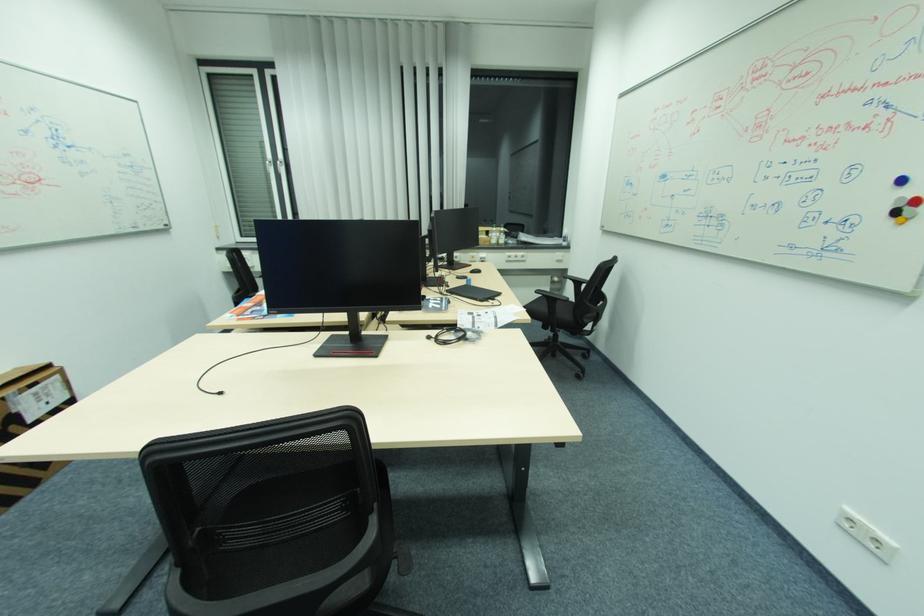
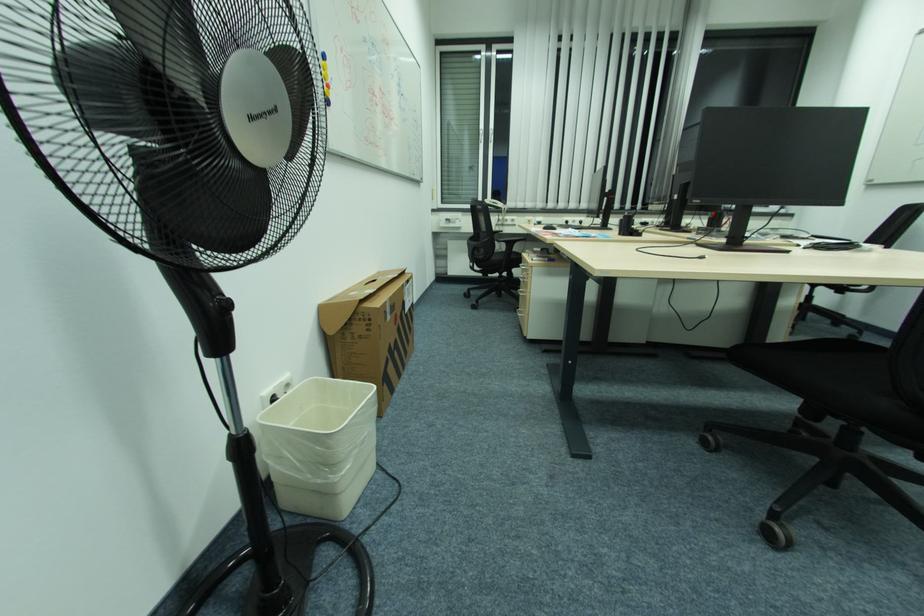
Question: Which direction would the cameraman need to move to produce the second image? Reply with the corresponding letter.

Choices:
 (A) Left
 (B) Right
 (C) Forward
 (D) Backward

Answer: (A)